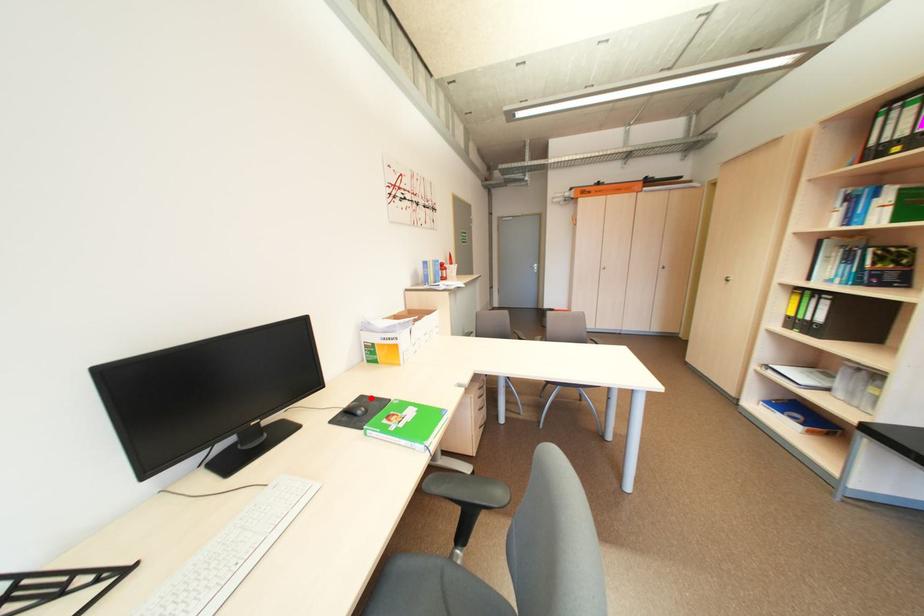
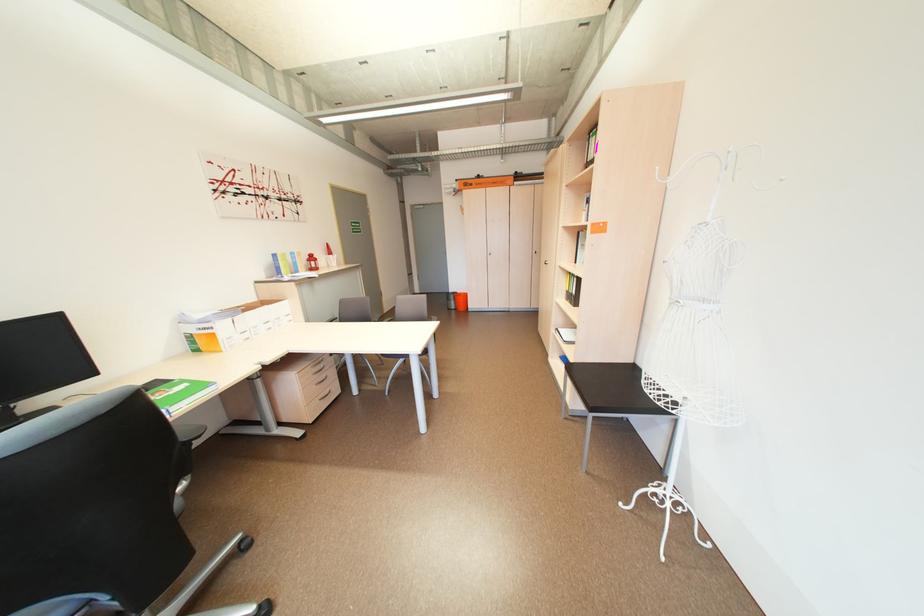
Find the pixel in the second image that matches the highlighted location in the first image.

(164, 382)